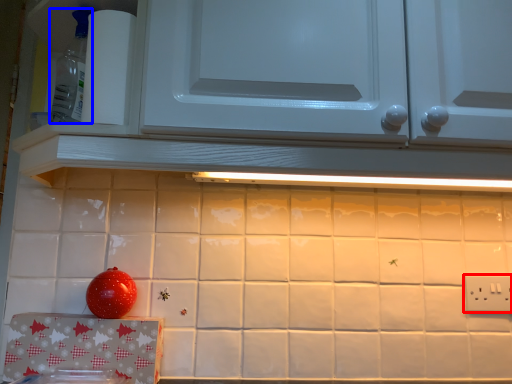
Question: Which point is closer to the camera, electric outlet (highlighted by a red box) or appliance (highlighted by a blue box)?

Choices:
 (A) electric outlet
 (B) appliance

Answer: (B)